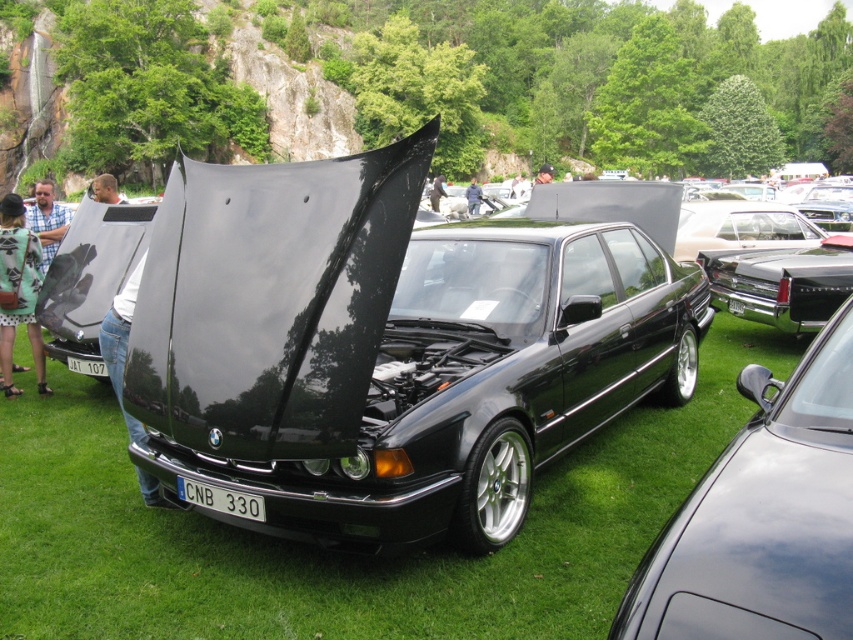
Which of these two, green textured dress at lower left or black leather jacket at center, stands taller?

black leather jacket at center is taller.

Does green textured dress at lower left have a lesser width compared to black leather jacket at center?

No, green textured dress at lower left is not thinner than black leather jacket at center.

Based on the photo, who is more distant from viewer, (7, 353) or (431, 195)?

Point (431, 195)

Locate an element on the screen. green textured dress at lower left is located at coordinates (18, 291).

Between point (103, 193) and point (474, 205), which one is positioned behind?

Positioned behind is point (474, 205).

Does brown hair at center appear on the left side of blue denim jeans at center?

Yes, brown hair at center is to the left of blue denim jeans at center.

Locate an element on the screen. The height and width of the screenshot is (640, 853). brown hair at center is located at coordinates (105, 189).

The height and width of the screenshot is (640, 853). In order to click on white plastic license plate at center in this screenshot , I will do `click(86, 365)`.

Based on the photo, who is higher up, white plastic license plate at center or blue denim jeans at center?

blue denim jeans at center is higher up.

Image resolution: width=853 pixels, height=640 pixels. I want to click on white plastic license plate at center, so click(86, 365).